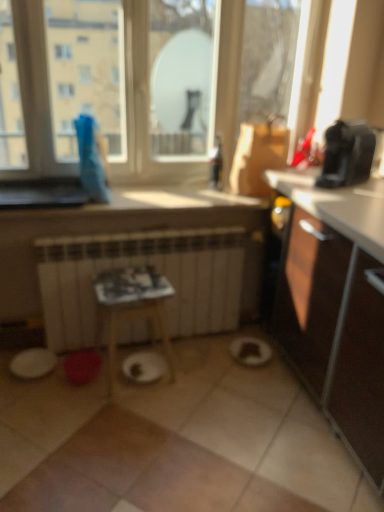
Where is `vacant region in front of wooden table at center`? The height and width of the screenshot is (512, 384). vacant region in front of wooden table at center is located at coordinates (127, 414).